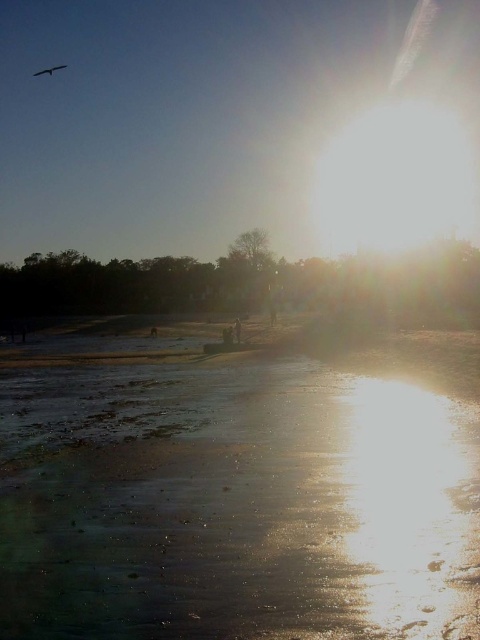
Question: Which of the following is the farthest from the observer?

Choices:
 (A) (0, 381)
 (B) (48, 70)

Answer: (B)

Question: Considering the relative positions of shiny sand at lower center and silvery metallic bird at upper left in the image provided, where is shiny sand at lower center located with respect to silvery metallic bird at upper left?

Choices:
 (A) above
 (B) below

Answer: (B)

Question: Is shiny sand at lower center smaller than silvery metallic bird at upper left?

Choices:
 (A) yes
 (B) no

Answer: (B)

Question: Can you confirm if shiny sand at lower center is positioned to the left of silvery metallic bird at upper left?

Choices:
 (A) yes
 (B) no

Answer: (B)